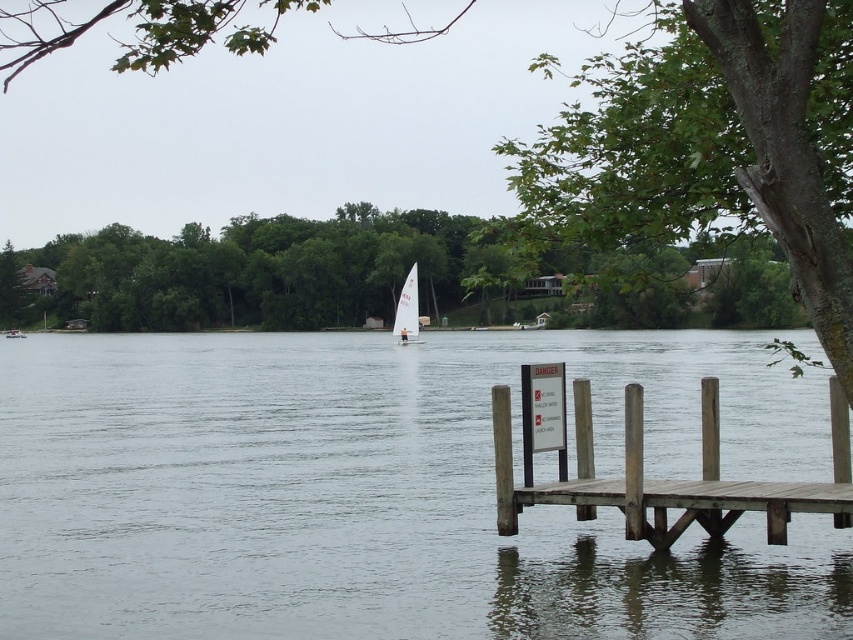
Question: Which of the following is the farthest from the observer?

Choices:
 (A) white sailboat at center
 (B) clear water at center
 (C) green leafy tree at upper center
 (D) brown wooden dock at lower right

Answer: (A)

Question: Can you confirm if green leafy tree at upper right is thinner than green leafy tree at upper center?

Choices:
 (A) yes
 (B) no

Answer: (A)

Question: Which point is closer to the camera?

Choices:
 (A) green leafy tree at upper right
 (B) brown wooden dock at lower right
 (C) white sailboat at center

Answer: (A)

Question: Is the position of brown wooden dock at lower right less distant than that of white sailboat at center?

Choices:
 (A) no
 (B) yes

Answer: (B)

Question: Which point appears closest to the camera in this image?

Choices:
 (A) (363, 276)
 (B) (407, 285)

Answer: (B)

Question: Is clear water at center bigger than green leafy tree at upper right?

Choices:
 (A) yes
 (B) no

Answer: (B)